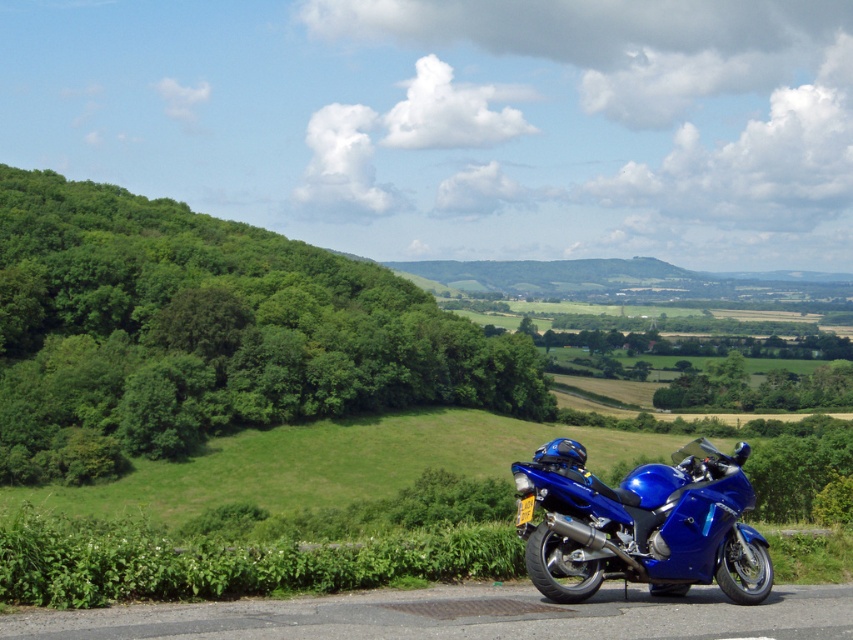
Question: Which of the following is the closest to the observer?

Choices:
 (A) green leafy tree at left
 (B) blue metallic motorcycle at lower right

Answer: (B)

Question: Considering the relative positions of green leafy tree at left and blue metallic motorcycle at lower right in the image provided, where is green leafy tree at left located with respect to blue metallic motorcycle at lower right?

Choices:
 (A) above
 (B) below

Answer: (A)

Question: Which point is closer to the camera taking this photo?

Choices:
 (A) (560, 488)
 (B) (18, 173)

Answer: (A)

Question: Can you confirm if green leafy tree at left is smaller than blue metallic motorcycle at lower right?

Choices:
 (A) no
 (B) yes

Answer: (A)

Question: Is green leafy tree at left positioned before blue metallic motorcycle at lower right?

Choices:
 (A) yes
 (B) no

Answer: (B)